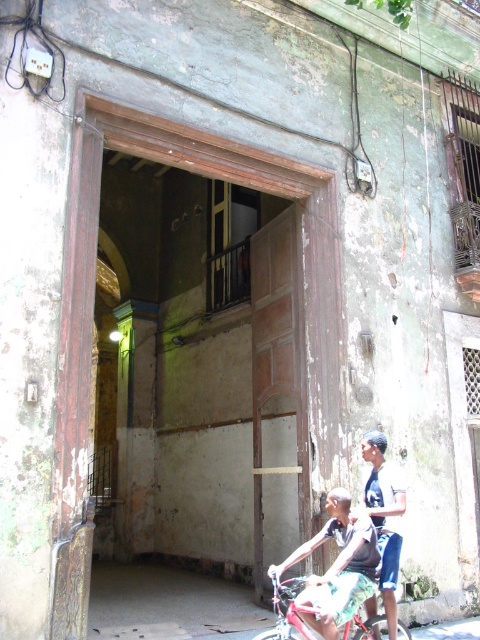
Question: In this image, where is dark blue shorts at center located relative to metallic red bicycle at center?

Choices:
 (A) above
 (B) below

Answer: (A)

Question: Which of the following is the closest to the observer?

Choices:
 (A) (282, 589)
 (B) (324, 538)

Answer: (A)

Question: Estimate the real-world distances between objects in this image. Which object is closer to the dark blue jersey at center?

Choices:
 (A) dark blue shorts at center
 (B) metallic red bicycle at center

Answer: (A)

Question: Which point is closer to the camera?

Choices:
 (A) (387, 628)
 (B) (359, 632)
 (C) (384, 605)

Answer: (B)

Question: Does dark blue shorts at center appear over dark blue jersey at center?

Choices:
 (A) yes
 (B) no

Answer: (B)

Question: Is dark blue shorts at center wider than dark blue jersey at center?

Choices:
 (A) no
 (B) yes

Answer: (B)